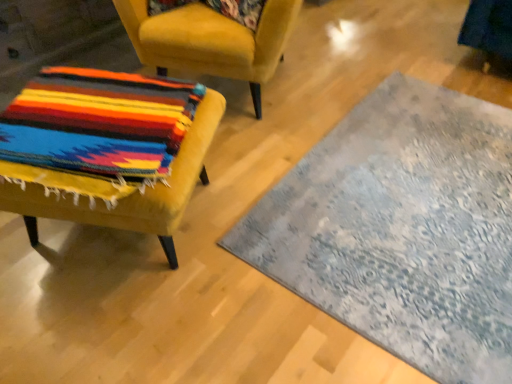
Where is `vacant area that lies to the right of velvet yellow chair at left, the 2th chair when ordered from top to bottom`? The height and width of the screenshot is (384, 512). vacant area that lies to the right of velvet yellow chair at left, the 2th chair when ordered from top to bottom is located at coordinates (239, 217).